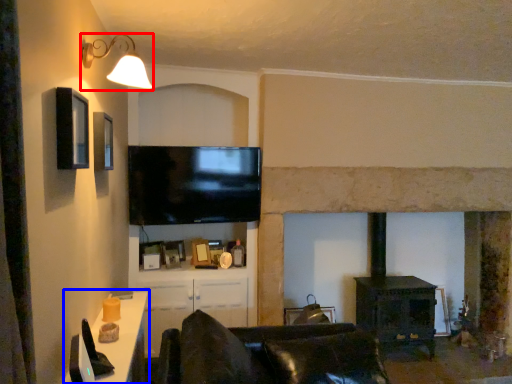
Question: Among these objects, which one is nearest to the camera, light fixture (highlighted by a red box) or table (highlighted by a blue box)?

Choices:
 (A) light fixture
 (B) table

Answer: (B)